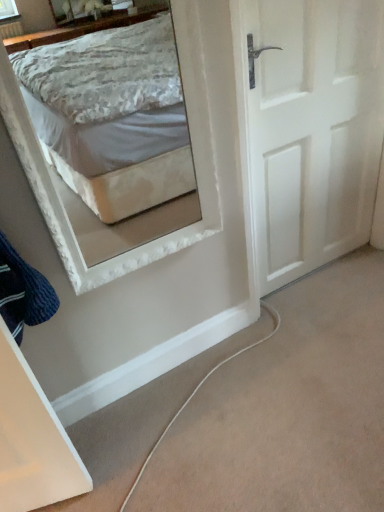
What do you see at coordinates (314, 130) in the screenshot? I see `white matte door at right` at bounding box center [314, 130].

What are the coordinates of `white matte door at right` in the screenshot? It's located at [x=314, y=130].

Describe the element at coordinates (23, 292) in the screenshot. I see `dark blue knitted sweater at lower left` at that location.

Find the location of `dark blue knitted sweater at lower left`. dark blue knitted sweater at lower left is located at coordinates (23, 292).

Locate an element on the screen. The width and height of the screenshot is (384, 512). white matte door at right is located at coordinates (314, 130).

Which object is positioned more to the right, white matte door at right or dark blue knitted sweater at lower left?

white matte door at right.

Is white matte door at right in front of or behind dark blue knitted sweater at lower left in the image?

white matte door at right is positioned farther from the viewer than dark blue knitted sweater at lower left.

Between point (339, 113) and point (6, 258), which one is positioned behind?

The point (339, 113) is farther.

From the image's perspective, between white matte door at right and dark blue knitted sweater at lower left, who is located below?

dark blue knitted sweater at lower left, from the image's perspective.

From a real-world perspective, is white matte door at right positioned over dark blue knitted sweater at lower left based on gravity?

No.

From the picture: Looking at their sizes, would you say white matte door at right is wider or thinner than dark blue knitted sweater at lower left?

Clearly, white matte door at right has less width compared to dark blue knitted sweater at lower left.

Is white matte door at right shorter than dark blue knitted sweater at lower left?

No.

Is white matte door at right smaller than dark blue knitted sweater at lower left?

No.

Which is correct: white matte door at right is inside dark blue knitted sweater at lower left, or outside of it?

white matte door at right cannot be found inside dark blue knitted sweater at lower left.

Is the surface of white matte door at right in direct contact with dark blue knitted sweater at lower left?

No.

Is white matte door at right positioned with its back to dark blue knitted sweater at lower left?

white matte door at right does not have its back to dark blue knitted sweater at lower left.

How far apart are white matte door at right and dark blue knitted sweater at lower left?

1.04 meters.

Identify the location of clothe that is below the white matte door at right (from the image's perspective). (23, 292).

Considering the positions of objects dark blue knitted sweater at lower left and white matte door at right in the image provided, who is more to the left, dark blue knitted sweater at lower left or white matte door at right?

Positioned to the left is dark blue knitted sweater at lower left.

Is the depth of dark blue knitted sweater at lower left less than that of white matte door at right?

That is True.

Which point is more distant from viewer, (7, 312) or (321, 65)?

The point (321, 65) is behind.

From the image's perspective, is dark blue knitted sweater at lower left positioned above or below white matte door at right?

Clearly, from the image's perspective, dark blue knitted sweater at lower left is below white matte door at right.

From a real-world perspective, is dark blue knitted sweater at lower left physically located above or below white matte door at right?

In terms of real-world spatial position, dark blue knitted sweater at lower left is above white matte door at right.

Between dark blue knitted sweater at lower left and white matte door at right, which one has larger width?

Wider between the two is dark blue knitted sweater at lower left.

Which of these two, dark blue knitted sweater at lower left or white matte door at right, stands taller?

white matte door at right is taller.

Based on the photo, between dark blue knitted sweater at lower left and white matte door at right, which one has larger size?

white matte door at right.

Is white matte door at right a part of dark blue knitted sweater at lower left?

No, white matte door at right is not inside dark blue knitted sweater at lower left.

Is dark blue knitted sweater at lower left directly adjacent to white matte door at right?

No, dark blue knitted sweater at lower left is not touching white matte door at right.

Consider the image. Is dark blue knitted sweater at lower left facing towards white matte door at right?

No, dark blue knitted sweater at lower left is not aimed at white matte door at right.

Looking at this image, can you tell me how much dark blue knitted sweater at lower left and white matte door at right differ in facing direction?

The angle between the facing direction of dark blue knitted sweater at lower left and the facing direction of white matte door at right is 74.6 degrees.

You are a GUI agent. You are given a task and a screenshot of the screen. Output one action in this format:
    pyautogui.click(x=<x>, y=<y>)
    Task: Click on the clothe lying on the left of white matte door at right
    
    Given the screenshot: What is the action you would take?
    pyautogui.click(x=23, y=292)

Where is `clothe that is in front of the white matte door at right`? clothe that is in front of the white matte door at right is located at coordinates (x=23, y=292).

Locate an element on the screen. This screenshot has width=384, height=512. clothe above the white matte door at right (from a real-world perspective) is located at coordinates (23, 292).